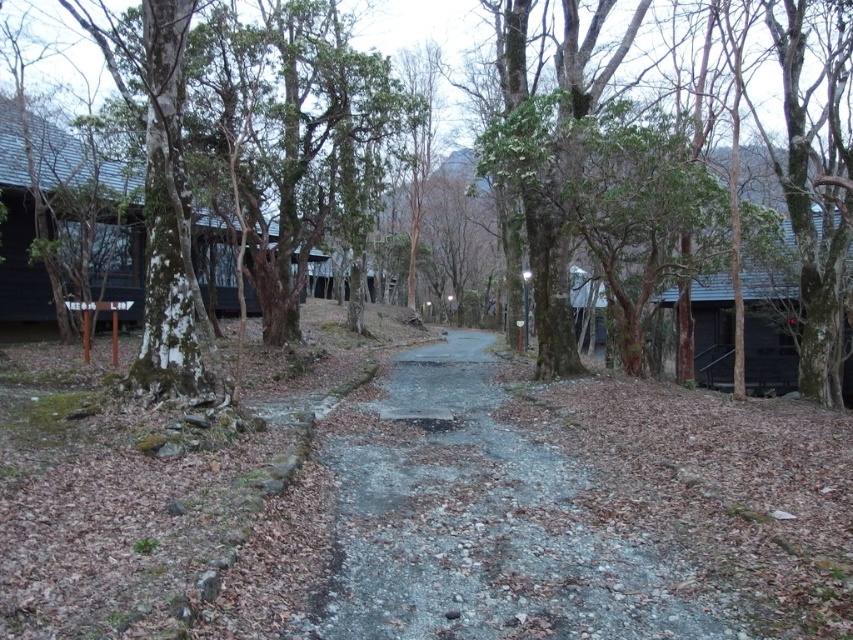
Does gray gravel path at center have a lesser height compared to matte black cabin at left?

Yes.

Locate an element on the screen. This screenshot has width=853, height=640. gray gravel path at center is located at coordinates (479, 522).

Does point (424, 385) come in front of point (13, 284)?

Yes, point (424, 385) is in front of point (13, 284).

This screenshot has height=640, width=853. What are the coordinates of `gray gravel path at center` in the screenshot? It's located at (479, 522).

Is gray gravel path at center positioned behind green rough bark tree at center?

No, it is in front of green rough bark tree at center.

Which is behind, point (430, 572) or point (405, 12)?

The point (405, 12) is behind.

This screenshot has width=853, height=640. Identify the location of gray gravel path at center. 479,522.

Image resolution: width=853 pixels, height=640 pixels. What do you see at coordinates (94, 211) in the screenshot?
I see `matte black cabin at left` at bounding box center [94, 211].

At what (x,y) coordinates should I click in order to perform the action: click on matte black cabin at left. Please return your answer as a coordinate pair (x, y). The image size is (853, 640). Looking at the image, I should click on (94, 211).

The image size is (853, 640). I want to click on matte black cabin at left, so click(94, 211).